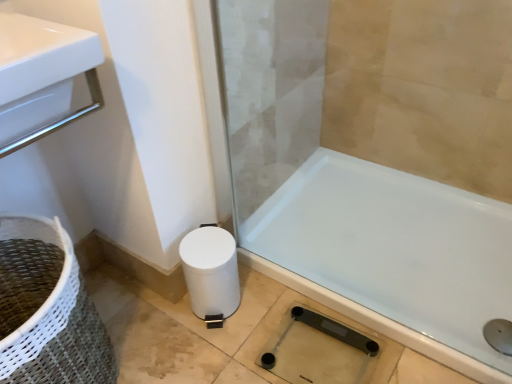
What are the coordinates of `empty space that is ontop of white glossy bathtub at lower right` in the screenshot? It's located at (320, 259).